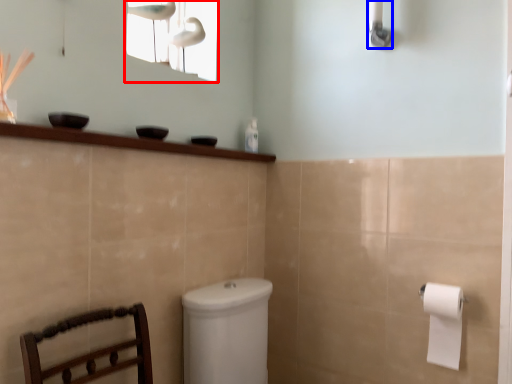
Question: Which object appears closest to the camera in this image, window screen (highlighted by a red box) or shower (highlighted by a blue box)?

Choices:
 (A) window screen
 (B) shower

Answer: (B)